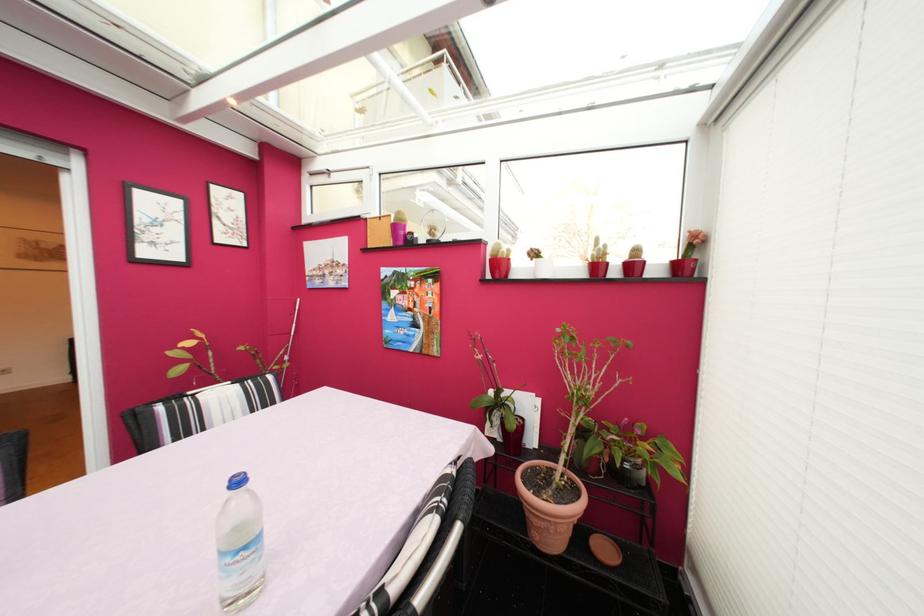
Where is `white window handle`? This screenshot has width=924, height=616. white window handle is located at coordinates (76, 283).